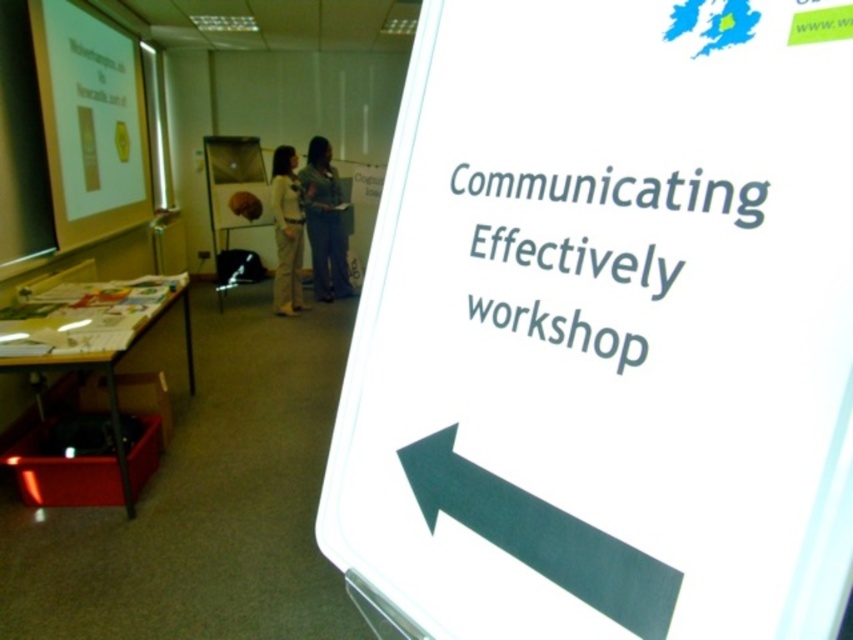
Question: Which object is farther from the camera taking this photo?

Choices:
 (A) light beige pants at center
 (B) denim pants at center
 (C) white paper sign at center
 (D) green matte arrow at lower left

Answer: (B)

Question: Which point is closer to the camera?

Choices:
 (A) denim pants at center
 (B) green matte arrow at lower left
 (C) white paper sign at center

Answer: (C)

Question: Is white glossy projector screen at upper left to the right of green matte arrow at lower left from the viewer's perspective?

Choices:
 (A) yes
 (B) no

Answer: (B)

Question: Among these points, which one is farthest from the camera?

Choices:
 (A) (289, 216)
 (B) (309, 209)
 (C) (558, 28)

Answer: (B)

Question: Is green matte arrow at lower left further to the viewer compared to denim pants at center?

Choices:
 (A) yes
 (B) no

Answer: (B)

Question: Does denim pants at center come in front of light beige pants at center?

Choices:
 (A) yes
 (B) no

Answer: (B)